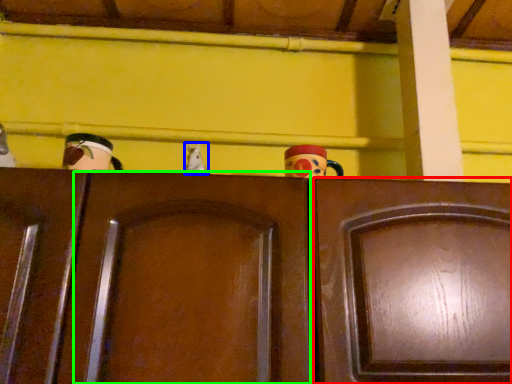
Question: Which object is positioned closest to door (highlighted by a red box)? Select from toy (highlighted by a blue box) and door (highlighted by a green box).

Choices:
 (A) toy
 (B) door

Answer: (B)